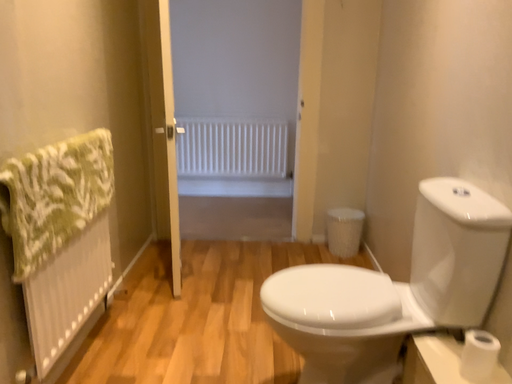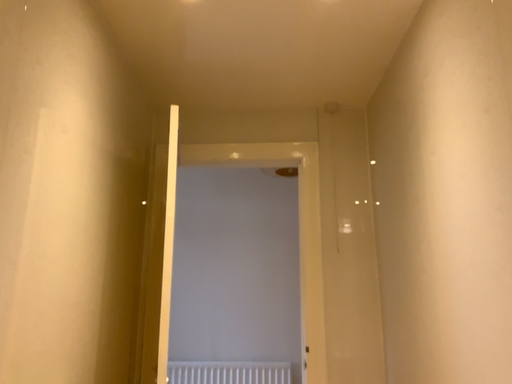
Question: How did the camera likely rotate when shooting the video?

Choices:
 (A) rotated downward
 (B) rotated upward

Answer: (B)